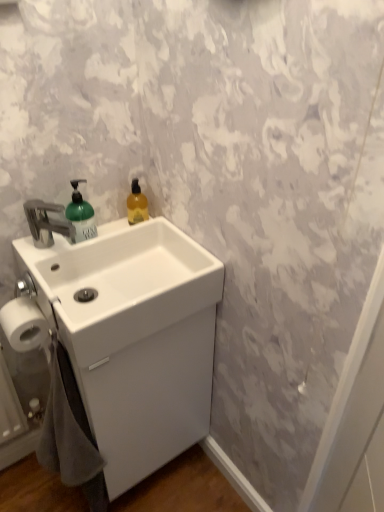
This screenshot has width=384, height=512. What do you see at coordinates (24, 324) in the screenshot? I see `white matte toilet paper at lower left` at bounding box center [24, 324].

The width and height of the screenshot is (384, 512). Identify the location of white glossy sink at center. (120, 285).

What do you see at coordinates (132, 336) in the screenshot?
I see `white glossy sink at center` at bounding box center [132, 336].

Where is `white matte toilet paper at lower left`? The height and width of the screenshot is (512, 384). white matte toilet paper at lower left is located at coordinates (24, 324).

Which of these two, gray cotton bath towel at lower left or green matte soap dispenser at left, stands shorter?

green matte soap dispenser at left.

From the image's perspective, between gray cotton bath towel at lower left and green matte soap dispenser at left, who is located below?

gray cotton bath towel at lower left.

Is gray cotton bath towel at lower left with green matte soap dispenser at left?

No, gray cotton bath towel at lower left is not next to green matte soap dispenser at left.

From a real-world perspective, does gray cotton bath towel at lower left stand above green matte soap dispenser at left?

Incorrect, from a real-world perspective, gray cotton bath towel at lower left is lower than green matte soap dispenser at left.

Could you tell me if white glossy sink at center is facing white matte toilet paper at lower left?

No, white glossy sink at center is not facing towards white matte toilet paper at lower left.

Does white glossy sink at center appear on the left side of white matte toilet paper at lower left?

In fact, white glossy sink at center is to the right of white matte toilet paper at lower left.

Does white glossy sink at center have a lesser width compared to white matte toilet paper at lower left?

Incorrect, the width of white glossy sink at center is not less than that of white matte toilet paper at lower left.

From a real-world perspective, which object stands above the other?

From a 3D spatial view, white glossy sink at center is above.

Is point (27, 306) in front of point (112, 482)?

Yes, point (27, 306) is in front of point (112, 482).

Is there a large distance between white matte toilet paper at lower left and white glossy sink at center?

white matte toilet paper at lower left is near white glossy sink at center, not far away.

Is white matte toilet paper at lower left smaller than white glossy sink at center?

Correct, white matte toilet paper at lower left occupies less space than white glossy sink at center.

From a real-world perspective, who is located higher, white matte toilet paper at lower left or white glossy sink at center?

From a 3D spatial view, white matte toilet paper at lower left is above.

Based on the photo, from the image's perspective, which is above, gray cotton bath towel at lower left or white matte toilet paper at lower left?

white matte toilet paper at lower left, from the image's perspective.

In terms of width, does gray cotton bath towel at lower left look wider or thinner when compared to white matte toilet paper at lower left?

gray cotton bath towel at lower left is wider than white matte toilet paper at lower left.

Which of these two, gray cotton bath towel at lower left or white matte toilet paper at lower left, is smaller?

white matte toilet paper at lower left is smaller.

Considering the positions of points (58, 466) and (15, 339), is point (58, 466) closer to camera compared to point (15, 339)?

No, it is behind (15, 339).

Does white matte toilet paper at lower left have a larger size compared to white glossy sink at center?

Incorrect, white matte toilet paper at lower left is not larger than white glossy sink at center.

Visually, is white matte toilet paper at lower left positioned to the left or to the right of white glossy sink at center?

In the image, white matte toilet paper at lower left appears on the left side of white glossy sink at center.

In terms of size, does white matte toilet paper at lower left appear bigger or smaller than green matte soap dispenser at left?

In the image, white matte toilet paper at lower left appears to be larger than green matte soap dispenser at left.

Is white matte toilet paper at lower left with green matte soap dispenser at left?

No, white matte toilet paper at lower left is not beside green matte soap dispenser at left.

Is point (33, 349) in front of point (76, 193)?

Yes, it is in front of point (76, 193).

Consider the image. From the image's perspective, which object appears higher, white matte toilet paper at lower left or green matte soap dispenser at left?

green matte soap dispenser at left is shown above in the image.

Is white glossy sink at center positioned behind white glossy sink at center?

No, it is not.

Which object is positioned more to the right, white glossy sink at center or white glossy sink at center?

white glossy sink at center is more to the right.

In the scene shown: From the image's perspective, which is below, white glossy sink at center or white glossy sink at center?

white glossy sink at center is shown below in the image.

Is white glossy sink at center oriented towards white glossy sink at center?

No, white glossy sink at center does not turn towards white glossy sink at center.

Identify the location of bath towel that appears on the left of green matte soap dispenser at left. This screenshot has width=384, height=512. (69, 431).

Locate an element on the screen. counter top located above the white matte toilet paper at lower left (from a real-world perspective) is located at coordinates (120, 285).

Estimate the real-world distances between objects in this image. Which object is closer to translucent amber liquid at upper right, gray cotton bath towel at lower left or white matte toilet paper at lower left?

white matte toilet paper at lower left is positioned closer to the anchor translucent amber liquid at upper right.

From the image, which object appears to be farther from gray cotton bath towel at lower left, translucent amber liquid at upper right or white matte toilet paper at lower left?

Among the two, translucent amber liquid at upper right is located further to gray cotton bath towel at lower left.

Estimate the real-world distances between objects in this image. Which object is further from white glossy sink at center, white glossy sink at center or green matte soap dispenser at left?

green matte soap dispenser at left is further to white glossy sink at center.

From the image, which object appears to be nearer to white glossy sink at center, gray cotton bath towel at lower left or green matte soap dispenser at left?

green matte soap dispenser at left lies closer to white glossy sink at center than the other object.

In the scene shown: Which object lies nearer to the anchor point white glossy sink at center, white matte toilet paper at lower left or gray cotton bath towel at lower left?

The object closer to white glossy sink at center is gray cotton bath towel at lower left.

Looking at this image, which object lies further to the anchor point white matte toilet paper at lower left, gray cotton bath towel at lower left or green matte soap dispenser at left?

Based on the image, green matte soap dispenser at left appears to be further to white matte toilet paper at lower left.

Considering their positions, is green matte soap dispenser at left positioned further to translucent amber liquid at upper right than white glossy sink at center?

white glossy sink at center lies further to translucent amber liquid at upper right than the other object.

From the image, which object appears to be nearer to white glossy sink at center, white matte toilet paper at lower left or translucent amber liquid at upper right?

white matte toilet paper at lower left is positioned closer to the anchor white glossy sink at center.

This screenshot has width=384, height=512. Find the location of `toilet paper that lies between translucent amber liquid at upper right and white glossy sink at center from top to bottom`. toilet paper that lies between translucent amber liquid at upper right and white glossy sink at center from top to bottom is located at coordinates (24, 324).

The image size is (384, 512). I want to click on sink between green matte soap dispenser at left and gray cotton bath towel at lower left in the vertical direction, so click(x=132, y=336).

Identify the location of soap dispenser positioned between white glossy sink at center and translucent amber liquid at upper right from near to far. (81, 214).

The height and width of the screenshot is (512, 384). Find the location of `counter top between translucent amber liquid at upper right and gray cotton bath towel at lower left vertically`. counter top between translucent amber liquid at upper right and gray cotton bath towel at lower left vertically is located at coordinates pos(120,285).